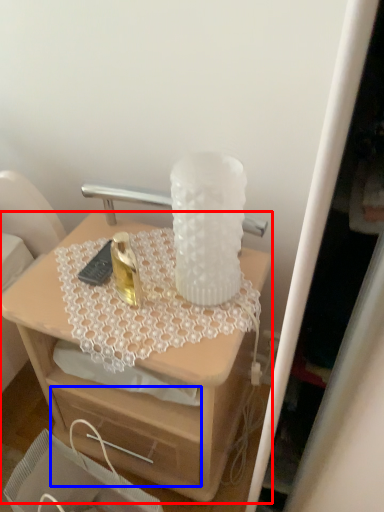
Question: Which of the following is the farthest to the observer, desk (highlighted by a red box) or drawer (highlighted by a blue box)?

Choices:
 (A) desk
 (B) drawer

Answer: (A)